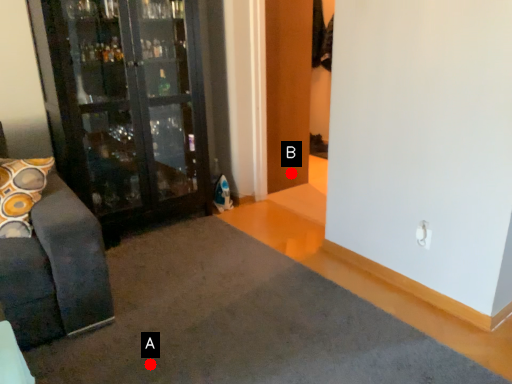
Question: Two points are circled on the image, labeled by A and B beside each circle. Which point is closer to the camera taking this photo?

Choices:
 (A) A is closer
 (B) B is closer

Answer: (A)